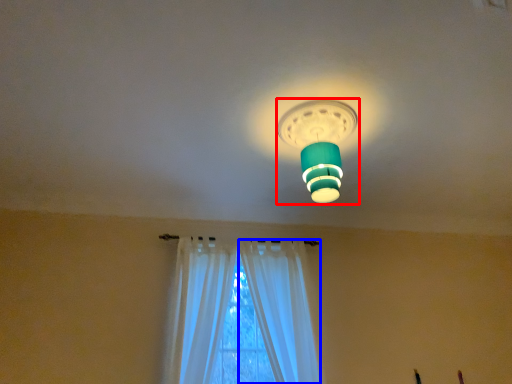
Question: Which object appears closest to the camera in this image, lamp (highlighted by a red box) or curtain (highlighted by a blue box)?

Choices:
 (A) lamp
 (B) curtain

Answer: (A)